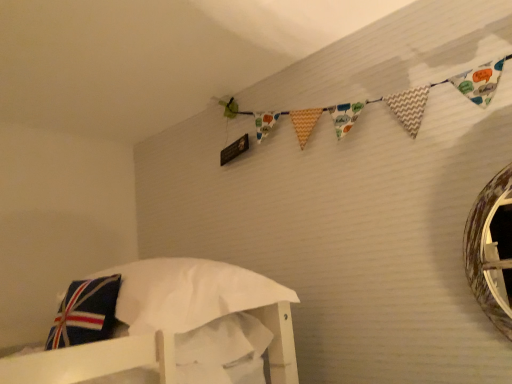
What do you see at coordinates (188, 293) in the screenshot? The image size is (512, 384). I see `velvety blue pillow at lower left` at bounding box center [188, 293].

Identify the location of velvety blue pillow at lower left. This screenshot has width=512, height=384. (188, 293).

In order to face velvety blue pillow at lower left, should I rotate leftwards or rightwards?

To align with it, rotate left about 12.325°.

This screenshot has height=384, width=512. In order to click on velvety blue pillow at lower left in this screenshot , I will do `click(188, 293)`.